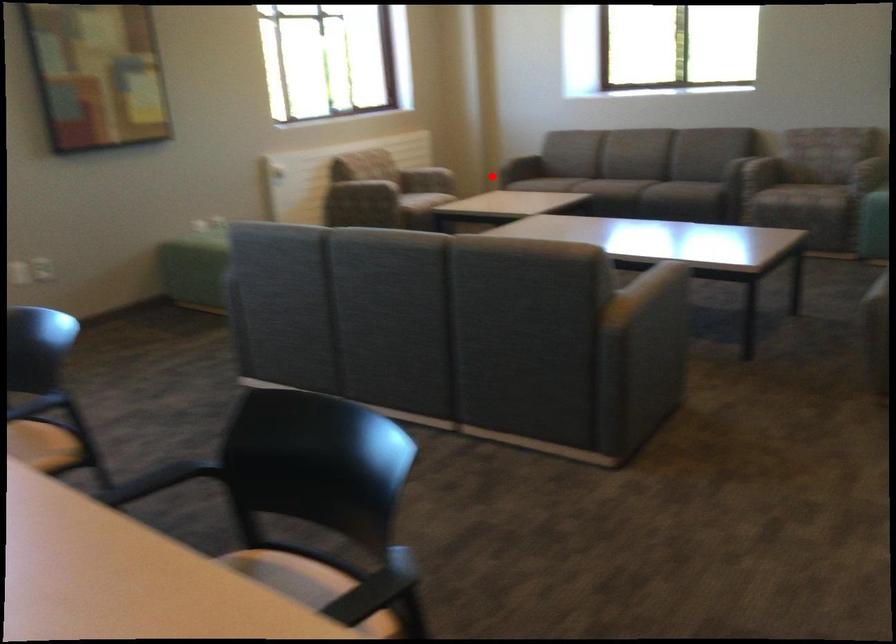
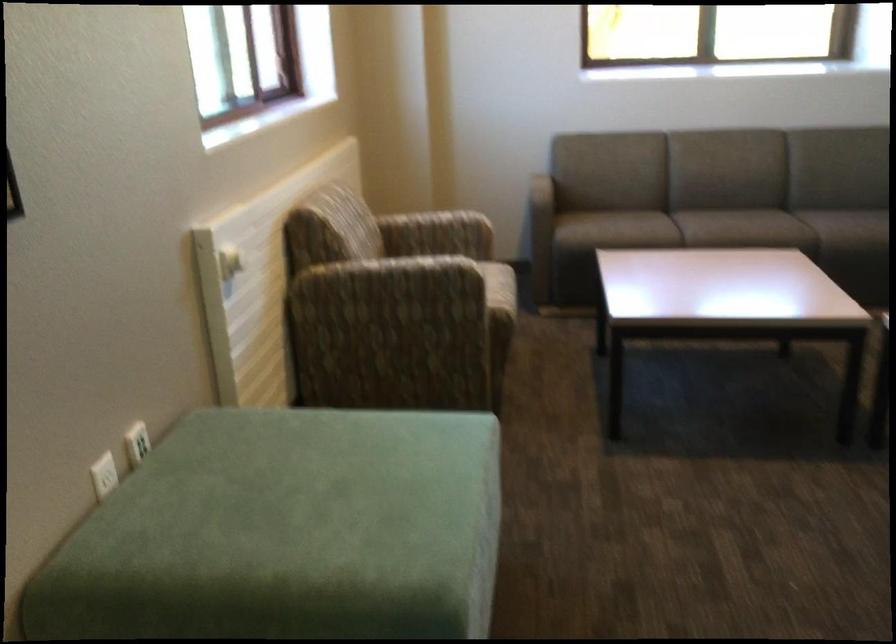
The point at the highlighted location is marked in the first image. Where is the corresponding point in the second image?

(540, 234)